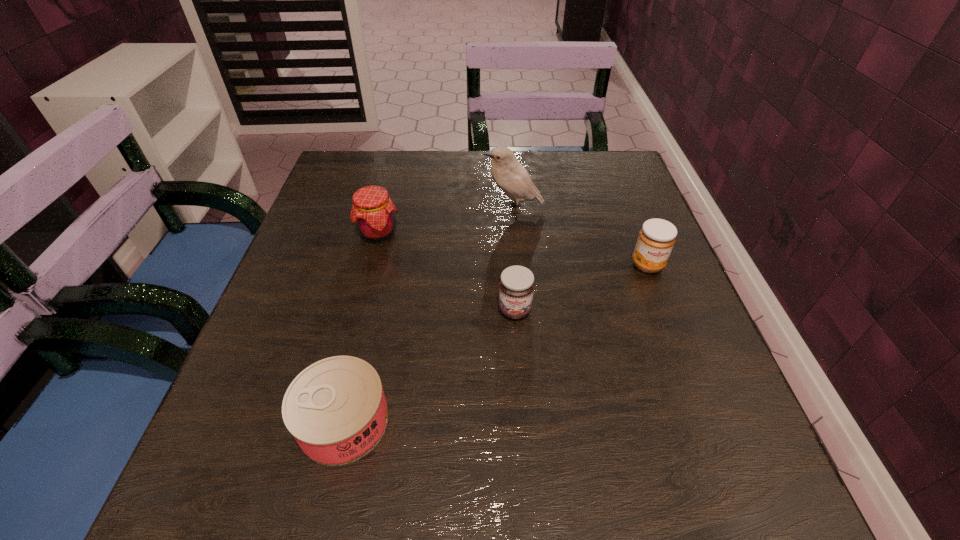
Image resolution: width=960 pixels, height=540 pixels. What are the coordinates of `bird` in the screenshot? It's located at (511, 177).

Locate an element on the screen. This screenshot has height=540, width=960. the farthest object is located at coordinates (511, 177).

Where is `the farthest jam`? This screenshot has width=960, height=540. the farthest jam is located at coordinates (372, 210).

At what (x,y) coordinates should I click in order to perform the action: click on the leftmost jam. Please return your answer as a coordinate pair (x, y). This screenshot has width=960, height=540. Looking at the image, I should click on (372, 210).

In order to click on the second farthest jam in this screenshot , I will do `click(656, 239)`.

Locate an element on the screen. The width and height of the screenshot is (960, 540). the rightmost jam is located at coordinates (656, 239).

Locate an element on the screen. Image resolution: width=960 pixels, height=540 pixels. the nearest jam is located at coordinates (516, 287).

Identify the location of the second jam from right to left. Image resolution: width=960 pixels, height=540 pixels. (516, 287).

Locate an element on the screen. the shortest object is located at coordinates 336,410.

Where is `can`? The height and width of the screenshot is (540, 960). can is located at coordinates (336, 410).